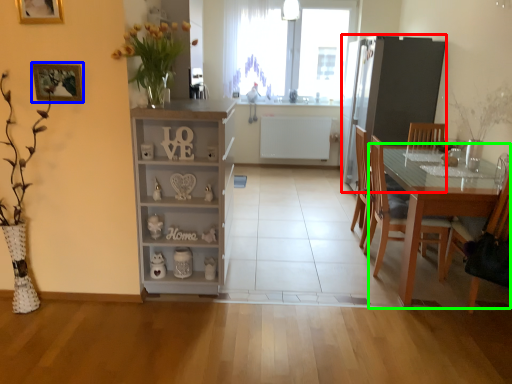
Question: Which object is positioned farthest from appliance (highlighted by a red box)? Select from picture frame (highlighted by a blue box) and table (highlighted by a green box).

Choices:
 (A) picture frame
 (B) table

Answer: (A)